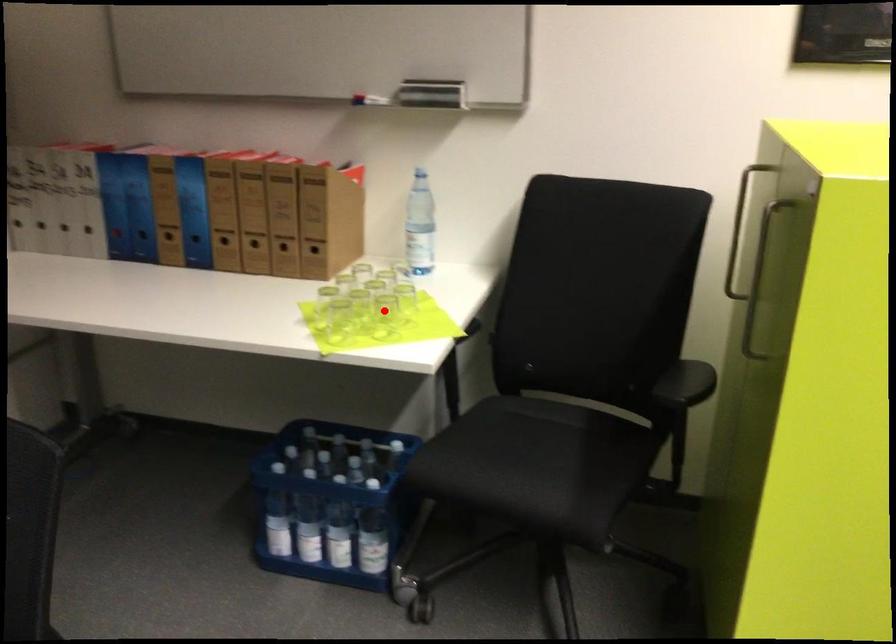
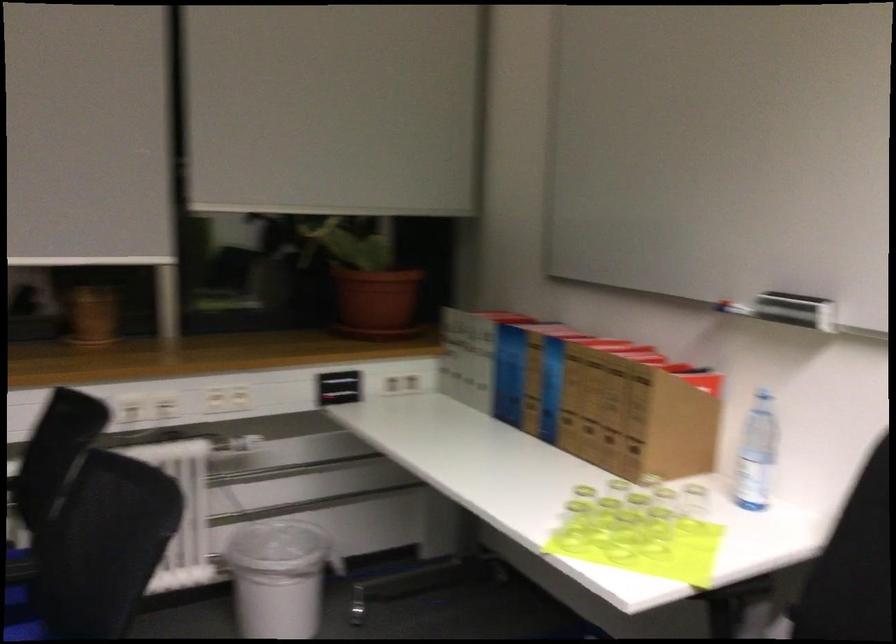
Locate, in the second image, the point that corresponds to the highlighted location in the first image.

(655, 534)